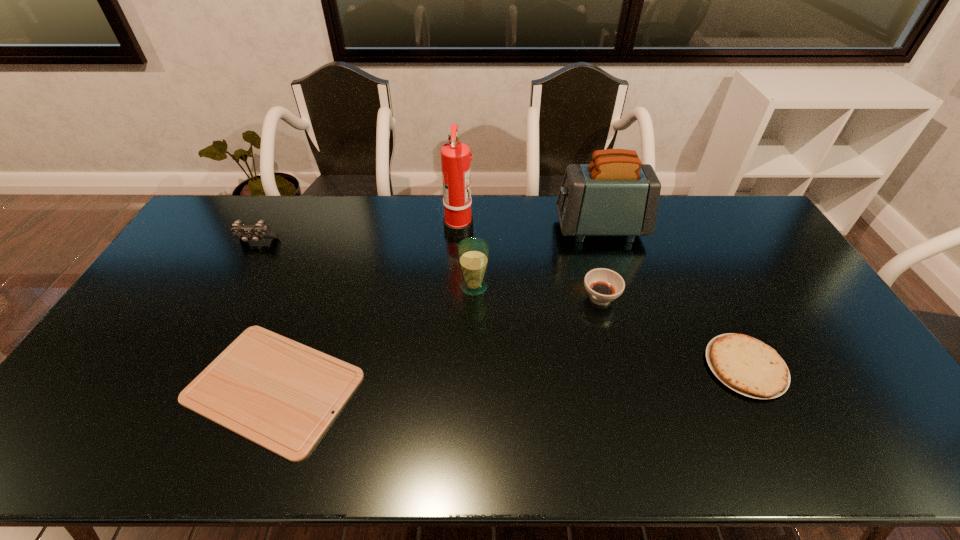
Where is `fire extinguisher`? fire extinguisher is located at coordinates (455, 156).

You are a GUI agent. You are given a task and a screenshot of the screen. Output one action in this format:
    pyautogui.click(x=<x>, y=<y>)
    Task: Click on the sixth shortest object
    Image resolution: width=960 pixels, height=540 pixels.
    Given the screenshot: What is the action you would take?
    pyautogui.click(x=615, y=195)

Locate an element on the screen. The height and width of the screenshot is (540, 960). the fifth shortest object is located at coordinates (473, 253).

You are a GUI agent. You are given a task and a screenshot of the screen. Output one action in this format:
    pyautogui.click(x=<x>, y=<y>)
    Task: Click on the control
    This screenshot has width=960, height=540.
    Given the screenshot: What is the action you would take?
    pyautogui.click(x=245, y=232)

Where is `the third shortest object`? This screenshot has height=540, width=960. the third shortest object is located at coordinates (603, 285).

The height and width of the screenshot is (540, 960). Find the location of `the sixth tallest object`. the sixth tallest object is located at coordinates (746, 365).

At what (x,y) coordinates should I click in order to perform the action: click on tortilla. Please return your answer as a coordinate pair (x, y). The image size is (960, 540). Looking at the image, I should click on (746, 365).

Identify the location of chopping board. (278, 393).

Locate an element on the screen. free point located 0.160m at the nozzle of the fire extinguisher is located at coordinates (517, 226).

In order to click on free space located on the front-facing side of the second tallest object in this screenshot , I will do `click(542, 228)`.